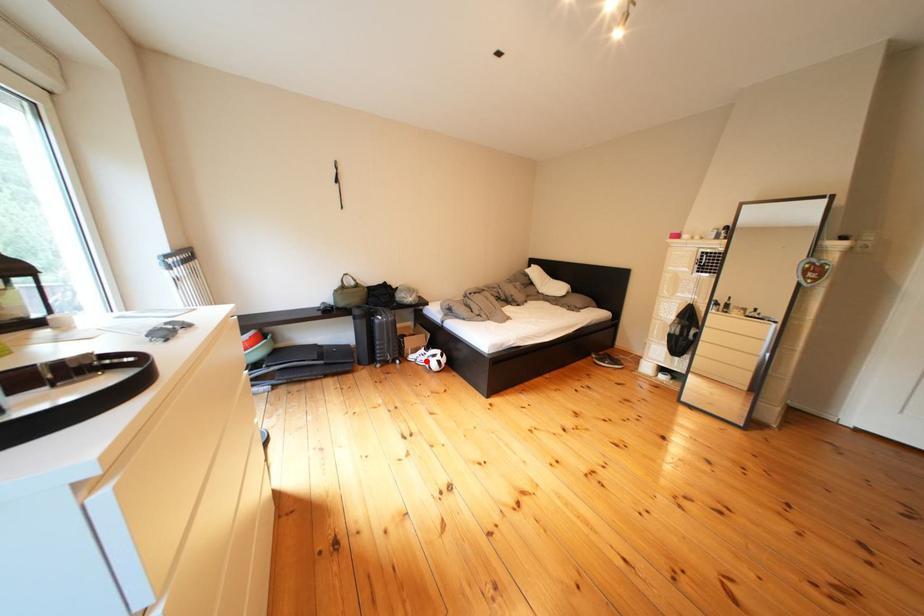
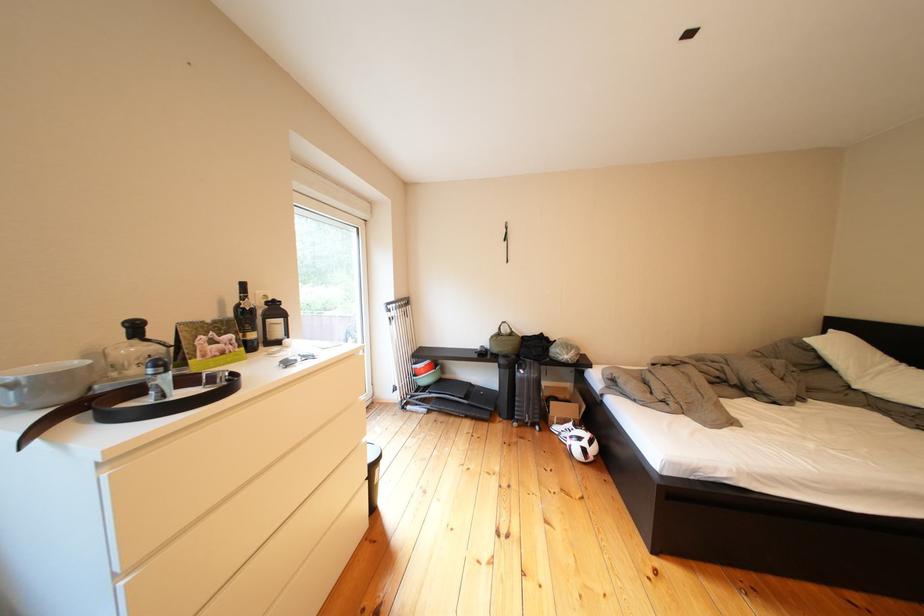
In the second image, find the point that corresponds to the highlighted location in the first image.

(570, 432)